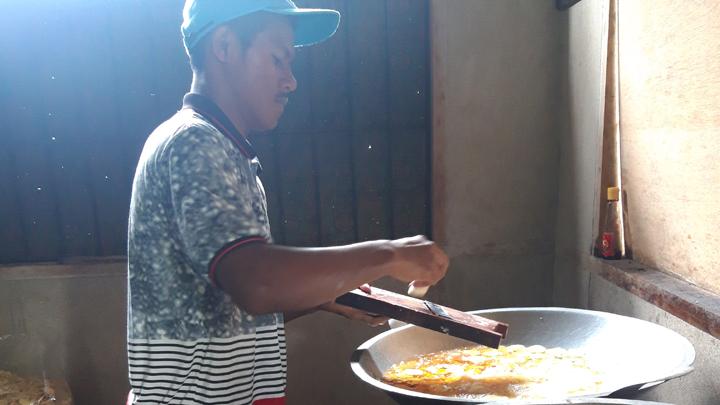
Find the location of a particular element. The width and height of the screenshot is (720, 405). wok is located at coordinates (387, 333), (683, 360), (567, 323), (436, 393), (386, 382), (623, 390), (567, 347), (679, 372).